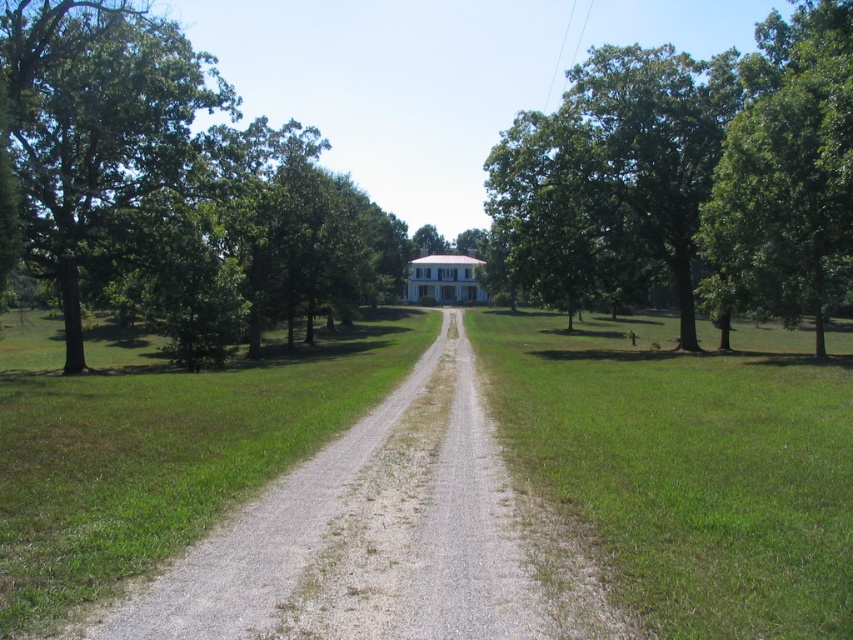
Based on the photo, can you confirm if gray gravel road at center is positioned to the left of green leafy tree at right?

Yes, gray gravel road at center is to the left of green leafy tree at right.

Which is more to the left, gray gravel road at center or green leafy tree at right?

From the viewer's perspective, gray gravel road at center appears more on the left side.

Is point (468, 508) more distant than point (759, 40)?

No.

The image size is (853, 640). In order to click on gray gravel road at center in this screenshot , I will do point(386,538).

Is green leafy tree at upper left to the right of gray gravel road at center from the viewer's perspective?

No, green leafy tree at upper left is not to the right of gray gravel road at center.

Who is positioned more to the left, green leafy tree at upper left or gray gravel road at center?

green leafy tree at upper left is more to the left.

Is point (49, 161) closer to camera compared to point (401, 387)?

That is False.

Locate an element on the screen. Image resolution: width=853 pixels, height=640 pixels. green leafy tree at upper left is located at coordinates (173, 186).

What do you see at coordinates (173, 186) in the screenshot? The height and width of the screenshot is (640, 853). I see `green leafy tree at upper left` at bounding box center [173, 186].

The width and height of the screenshot is (853, 640). What do you see at coordinates (173, 186) in the screenshot? I see `green leafy tree at upper left` at bounding box center [173, 186].

This screenshot has height=640, width=853. Find the location of `green leafy tree at upper left`. green leafy tree at upper left is located at coordinates (173, 186).